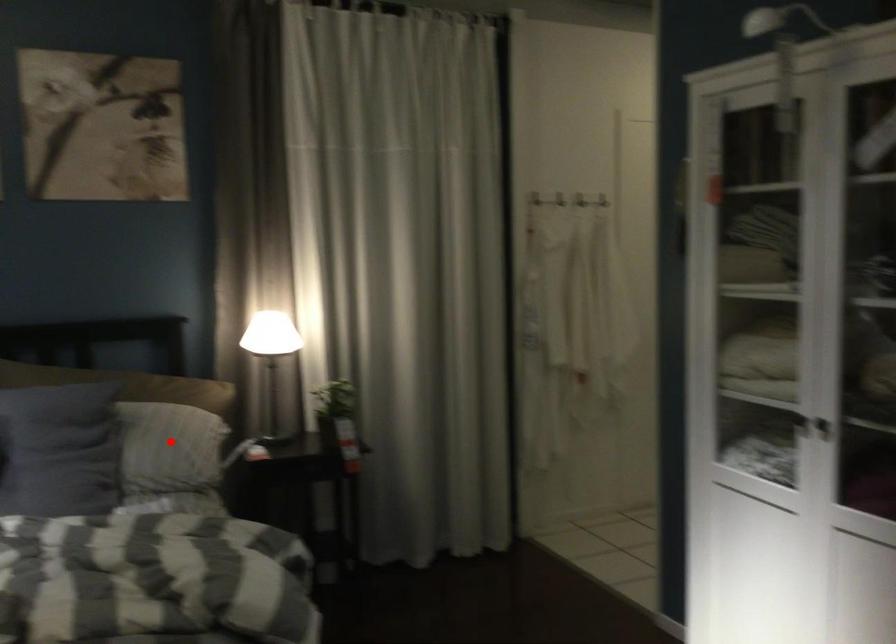
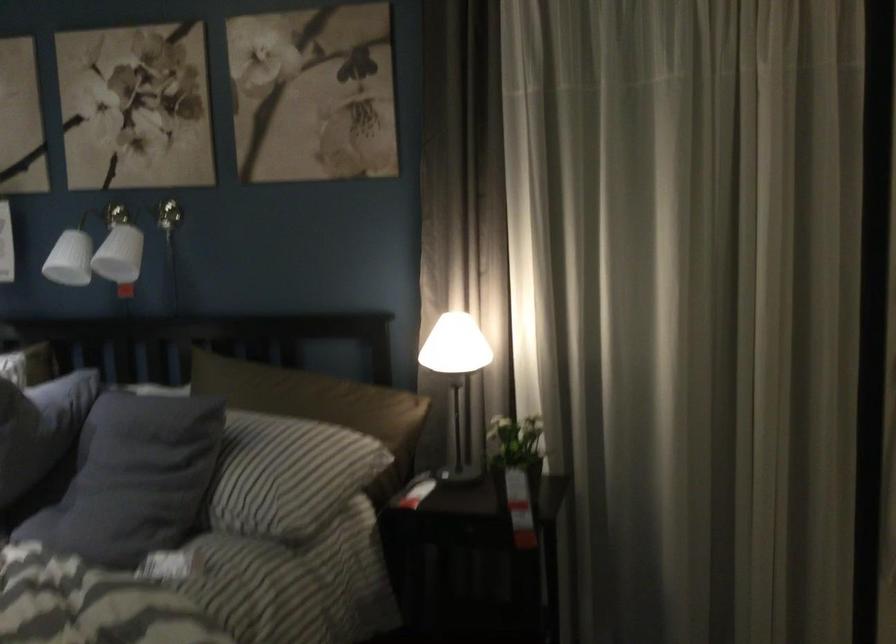
Question: I am providing you with two images of the same scene from different viewpoints. Given a red point in image1, look at the same physical point in image2. Is it:

Choices:
 (A) Closer to the viewpoint
 (B) Farther from the viewpoint

Answer: (A)